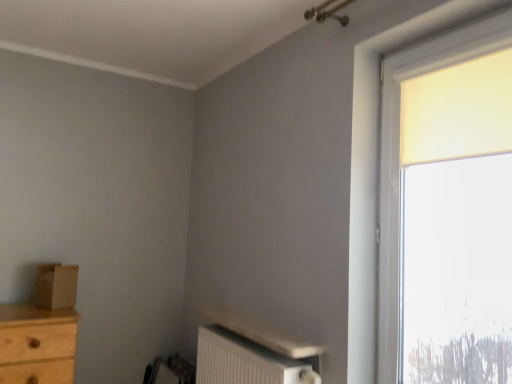
Question: Is brown cardboard box at left turned away from matte yellow curtain at upper right?

Choices:
 (A) yes
 (B) no

Answer: (B)

Question: Does brown cardboard box at left have a larger size compared to matte yellow curtain at upper right?

Choices:
 (A) no
 (B) yes

Answer: (A)

Question: From the image's perspective, is brown cardboard box at left over matte yellow curtain at upper right?

Choices:
 (A) no
 (B) yes

Answer: (A)

Question: From a real-world perspective, is brown cardboard box at left on matte yellow curtain at upper right?

Choices:
 (A) no
 (B) yes

Answer: (A)

Question: From the image's perspective, is brown cardboard box at left under matte yellow curtain at upper right?

Choices:
 (A) no
 (B) yes

Answer: (B)

Question: Considering the positions of point click(x=291, y=367) and point click(x=74, y=281), is point click(x=291, y=367) closer or farther from the camera than point click(x=74, y=281)?

Choices:
 (A) farther
 (B) closer

Answer: (B)

Question: Do you think white textured radiator at lower center is within brown cardboard box at left, or outside of it?

Choices:
 (A) inside
 (B) outside

Answer: (B)

Question: Considering their positions, is white textured radiator at lower center located in front of or behind brown cardboard box at left?

Choices:
 (A) behind
 (B) front

Answer: (B)

Question: Considering the relative positions of white textured radiator at lower center and brown cardboard box at left in the image provided, is white textured radiator at lower center to the left or to the right of brown cardboard box at left?

Choices:
 (A) right
 (B) left

Answer: (A)

Question: Considering the positions of point (495, 34) and point (497, 122), is point (495, 34) closer or farther from the camera than point (497, 122)?

Choices:
 (A) closer
 (B) farther

Answer: (B)

Question: Based on their sizes in the image, would you say matte yellow curtain at right is bigger or smaller than matte yellow curtain at upper right?

Choices:
 (A) big
 (B) small

Answer: (A)

Question: Is matte yellow curtain at right to the left or to the right of matte yellow curtain at upper right in the image?

Choices:
 (A) right
 (B) left

Answer: (B)

Question: From the image's perspective, is matte yellow curtain at right above or below matte yellow curtain at upper right?

Choices:
 (A) below
 (B) above

Answer: (A)

Question: Does point (507, 109) appear closer or farther from the camera than point (394, 102)?

Choices:
 (A) farther
 (B) closer

Answer: (B)

Question: In terms of size, does matte yellow curtain at upper right appear bigger or smaller than matte yellow curtain at right?

Choices:
 (A) big
 (B) small

Answer: (B)